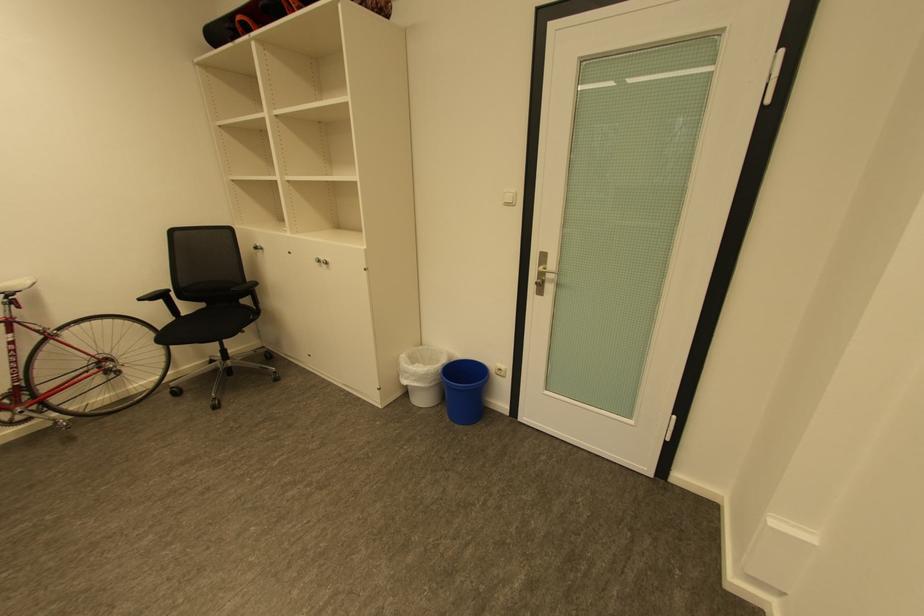
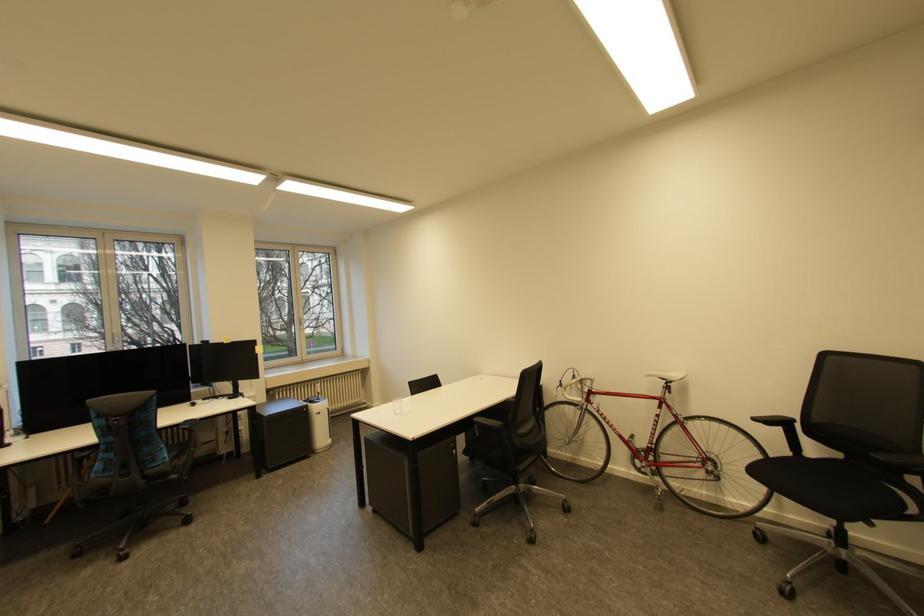
Question: The first image is from the beginning of the video and the second image is from the end. How did the camera likely rotate when shooting the video?

Choices:
 (A) Left
 (B) Right
 (C) Up
 (D) Down

Answer: (A)